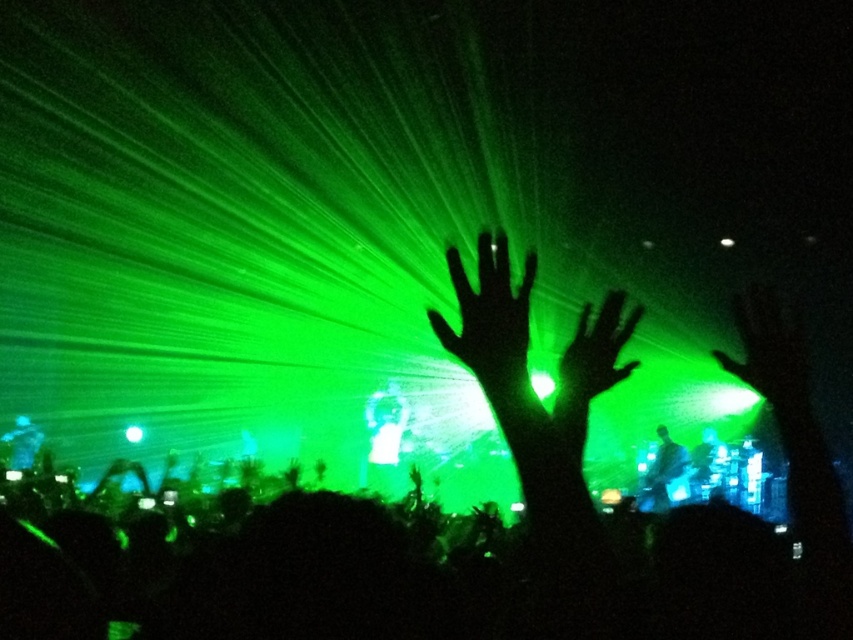
Question: Does black matte hand at center lie behind green translucent hand at upper right?

Choices:
 (A) yes
 (B) no

Answer: (B)

Question: Which object appears closest to the camera in this image?

Choices:
 (A) green matte hand at center
 (B) shiny black guitar at center

Answer: (A)

Question: Which point is farther to the camera?

Choices:
 (A) green translucent hand at upper right
 (B) translucent white figure at center
 (C) green matte hand at center

Answer: (B)

Question: Does green translucent hand at upper right appear on the left side of shiny black guitar at center?

Choices:
 (A) yes
 (B) no

Answer: (B)

Question: Which of the following is the farthest from the observer?

Choices:
 (A) (370, 419)
 (B) (775, 404)
 (C) (518, 342)

Answer: (A)

Question: From the image, what is the correct spatial relationship of silhouette hands at center in relation to translucent white figure at center?

Choices:
 (A) right
 (B) left

Answer: (A)